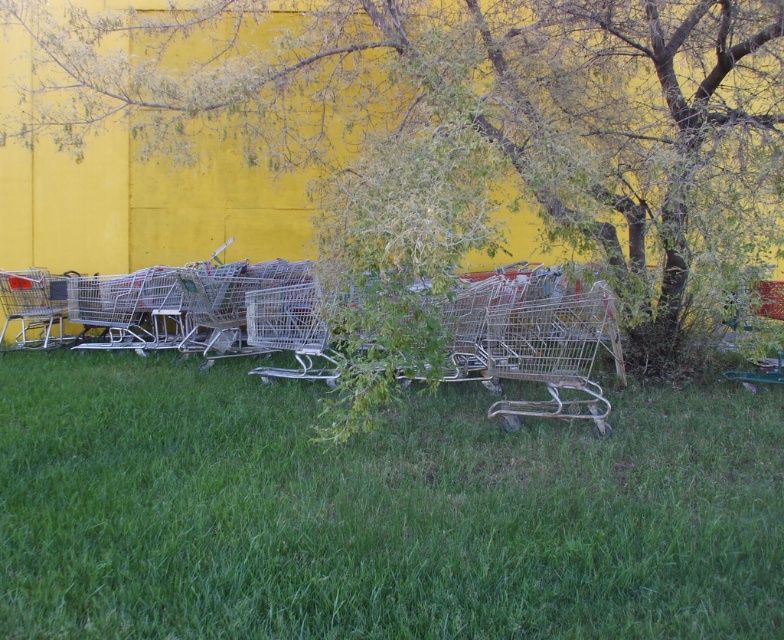
You are a gardener trying to determine if there is enough space between the green leafy tree at center and the metallic silver shopping cart at right to place a new bench. Can you fit a bench that is 1.2 meters wide between them?

The green leafy tree at center might be wider than the metallic silver shopping cart at right, but without knowing the exact width of the tree or the distance between them, it is uncertain if the bench will fit. More information is needed to determine the space availability.

You are a gardener who wants to mow the green grass at lower center. You have a lawnmower that can only move forward in a straight line. The silver metallic shopping cart at left is blocking your path. Can you mow the grass without moving the shopping cart?

The green grass at lower center occupies less space than the silver metallic shopping cart at left. Since the grass area is smaller, the lawnmower might be able to navigate around the shopping cart by moving along the edges of the grass area, avoiding the obstruction. However, the exact feasibility depends on the lawnmower size and the available space between the cart and other objects.

You are a gardener trying to mow the green grass at lower center. You have a lawnmower that can only move straight forward. There is a silver metallic shopping cart at left in the way. Based on the scene, can you determine if the grass area is wide enough to maneuver around the shopping cart?

The green grass at lower center is wider than the silver metallic shopping cart at left, so yes, the lawnmower can maneuver around the shopping cart by moving along the wider grass area.